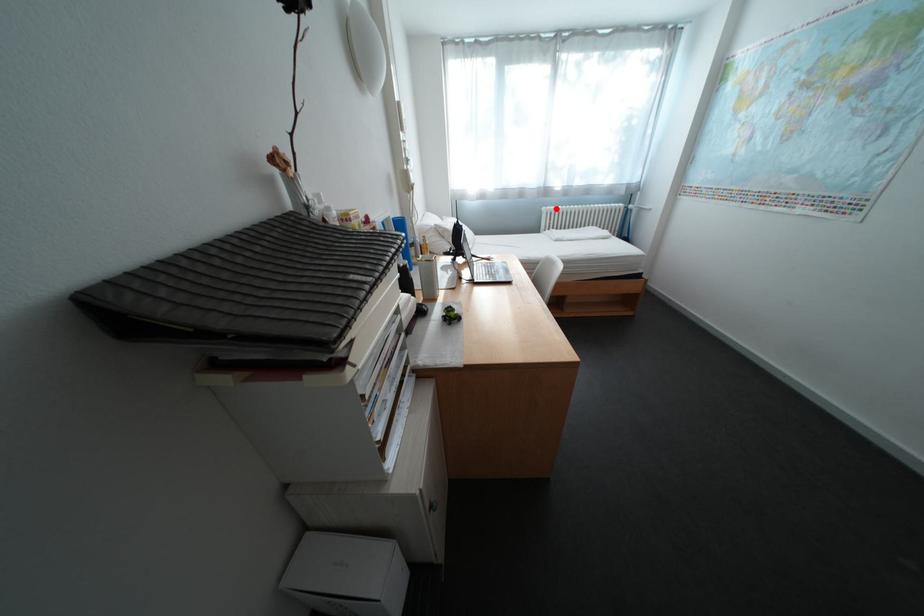
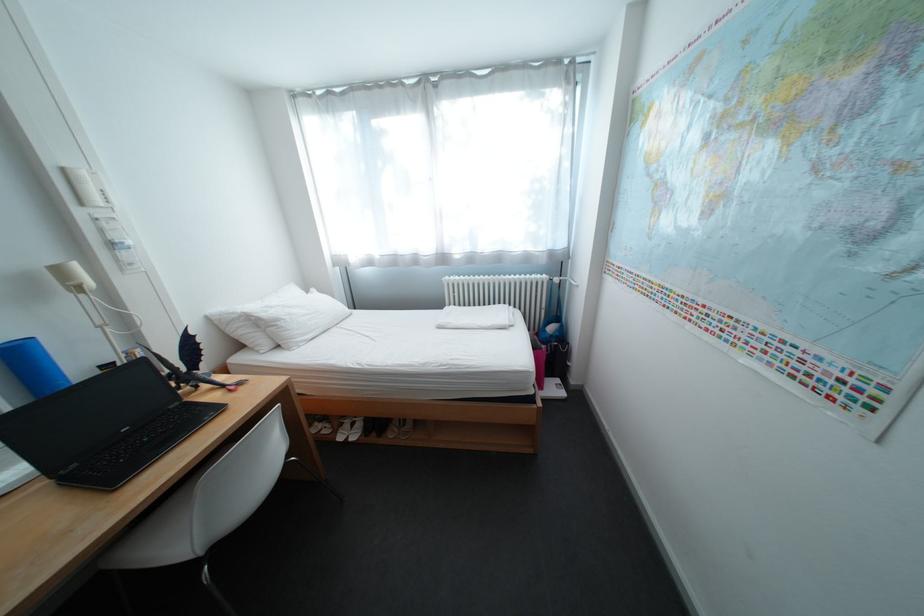
Question: I am providing you with two images of the same scene from different viewpoints. In image1, a red point is highlighted. Considering the same 3D point in image2, which of the following is correct?

Choices:
 (A) It is closer
 (B) It is farther

Answer: (B)